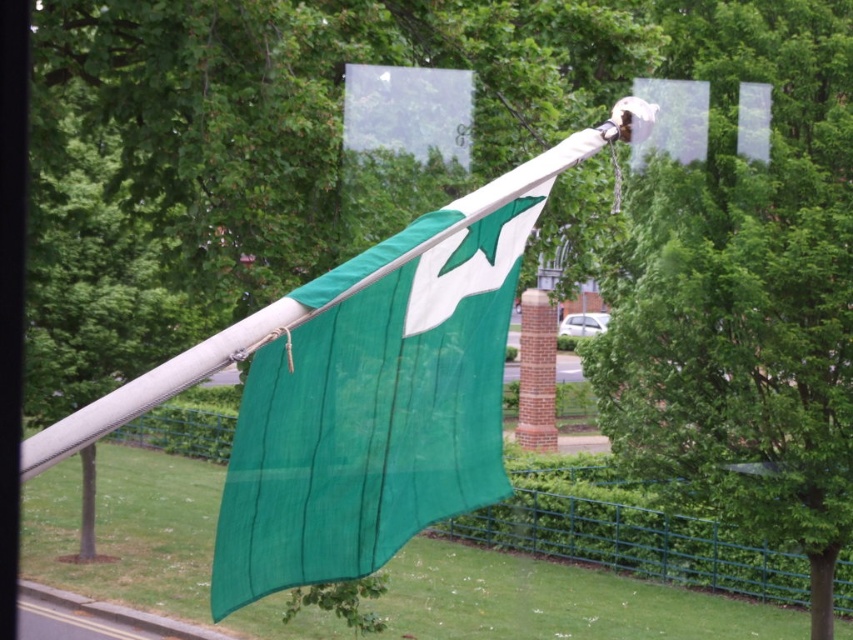
Question: Can you confirm if green fabric flag at center is bigger than green metal fence at lower center?

Choices:
 (A) no
 (B) yes

Answer: (B)

Question: Which object is closer to the camera taking this photo?

Choices:
 (A) green metal fence at lower center
 (B) green fabric tree at upper center

Answer: (B)

Question: Observing the image, what is the correct spatial positioning of green fabric flag at center in reference to green metal fence at lower center?

Choices:
 (A) above
 (B) below

Answer: (A)

Question: Which point appears closest to the camera in this image?

Choices:
 (A) (802, 93)
 (B) (463, 289)
 (C) (633, 528)

Answer: (B)

Question: Which object is positioned closest to the green metal fence at lower center?

Choices:
 (A) green fabric flag at center
 (B) green fabric tree at upper center

Answer: (B)

Question: Is green fabric flag at center to the right of green metal fence at lower center from the viewer's perspective?

Choices:
 (A) no
 (B) yes

Answer: (A)